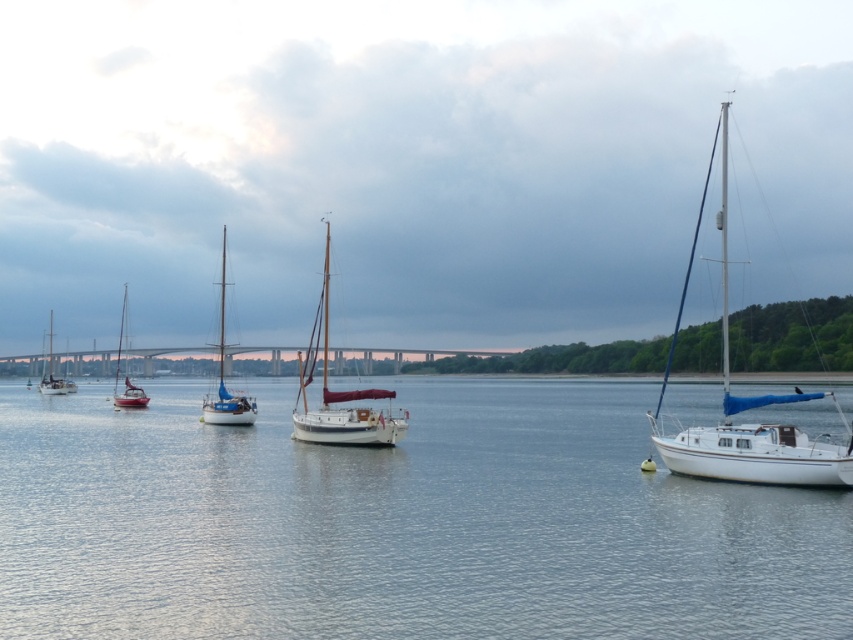
From the picture: You are standing at the edge of the waterfront and see two points marked in the image. Which point, point [788,429] or point [228,401], is closer to you?

Point [788,429] is closer to the viewer than point [228,401].

You are standing on the dock and looking out at the water. You see the white matte sailboat at center and the white sailboat at left. Which boat is positioned closer to the shore?

The white sailboat at left is closer to the shore because the white matte sailboat at center is located above it, meaning it is further away from the observer.

You are a photographer positioned at the center of the scene. You want to capture a photo of the white matte sailboat at right. Based on its 2D coordinates, which direction should you point your camera to frame it properly?

The white matte sailboat at right is located at coordinates 0.637 on the x axis and 0.876 on the y axis. Since the photographer is at the center, pointing the camera to the upper right direction will properly frame the sailboat.